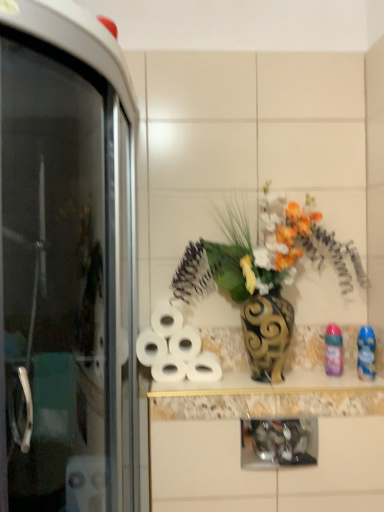
Question: From the image's perspective, relative to white matte toilet paper at center, which appears as the first toilet paper when viewed from the top, is white matte toilet paper at center, marked as the 3th toilet paper in a top-to-bottom arrangement, above or below?

Choices:
 (A) below
 (B) above

Answer: (A)

Question: Is point (139, 357) positioned closer to the camera than point (170, 309)?

Choices:
 (A) farther
 (B) closer

Answer: (B)

Question: Which object is the farthest from the white matte toilet paper at center, positioned as the fifth toilet paper in bottom-to-top order?

Choices:
 (A) transparent glass screen door at left
 (B) white matte toilet paper at center, placed as the fifth toilet paper when sorted from top to bottom
 (C) white matte toilet paper at center, which is counted as the 2th toilet paper, starting from the top
 (D) white matte toilet paper at center, the 2th toilet paper in the bottom-to-top sequence
 (E) metallic gold vase at center

Answer: (A)

Question: Considering the real-world distances, which object is closest to the white matte toilet paper at center, which is counted as the 2th toilet paper, starting from the top?

Choices:
 (A) white matte toilet paper at center, positioned as the 3th toilet paper in bottom-to-top order
 (B) metallic gold vase at center
 (C) white matte toilet paper at center, the 4th toilet paper in the top-to-bottom sequence
 (D) transparent glass screen door at left
 (E) white matte toilet paper at center, which appears as the first toilet paper when viewed from the top

Answer: (C)